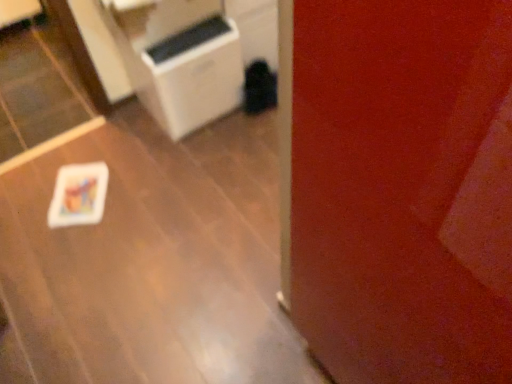
In order to face white glossy table at lower left, should I rotate leftwards or rightwards?

You should look left and rotate roughly 13.319 degrees.

What do you see at coordinates (153, 262) in the screenshot? Image resolution: width=512 pixels, height=384 pixels. I see `white glossy table at lower left` at bounding box center [153, 262].

Where is `white glossy table at lower left`? This screenshot has width=512, height=384. white glossy table at lower left is located at coordinates (153, 262).

In order to face white plastic air purifier at center, should I rotate leftwards or rightwards?

Turn left approximately 9.109 degrees to face it.

The image size is (512, 384). What do you see at coordinates (194, 76) in the screenshot? I see `white plastic air purifier at center` at bounding box center [194, 76].

Locate an element on the screen. white plastic air purifier at center is located at coordinates point(194,76).

At what (x,y) coordinates should I click in order to perform the action: click on white glossy table at lower left. Please return your answer as a coordinate pair (x, y). The image size is (512, 384). Looking at the image, I should click on (153, 262).

From the picture: Can you confirm if white plastic air purifier at center is positioned to the right of white glossy table at lower left?

Yes.

Is the depth of white plastic air purifier at center less than that of white glossy table at lower left?

No, it is not.

Does point (242, 74) come farther from viewer compared to point (232, 340)?

Yes.

From the image's perspective, between white plastic air purifier at center and white glossy table at lower left, which one is located above?

white plastic air purifier at center appears higher in the image.

From a real-world perspective, does white plastic air purifier at center sit lower than white glossy table at lower left?

No, from a real-world perspective, white plastic air purifier at center is not under white glossy table at lower left.

Considering the sizes of objects white plastic air purifier at center and white glossy table at lower left in the image provided, who is thinner, white plastic air purifier at center or white glossy table at lower left?

Thinner between the two is white plastic air purifier at center.

Considering the sizes of objects white plastic air purifier at center and white glossy table at lower left in the image provided, who is shorter, white plastic air purifier at center or white glossy table at lower left?

white glossy table at lower left.

Which of these two, white plastic air purifier at center or white glossy table at lower left, is smaller?

With smaller size is white glossy table at lower left.

Is white plastic air purifier at center not inside white glossy table at lower left?

Yes, white plastic air purifier at center is located beyond the bounds of white glossy table at lower left.

Is white plastic air purifier at center beside white glossy table at lower left?

No, white plastic air purifier at center is not next to white glossy table at lower left.

Does white plastic air purifier at center turn towards white glossy table at lower left?

No, white plastic air purifier at center is not aimed at white glossy table at lower left.

Can you tell me how much white plastic air purifier at center and white glossy table at lower left differ in facing direction?

There is a 0.426-degree angle between the facing directions of white plastic air purifier at center and white glossy table at lower left.

At what (x,y) coordinates should I click in order to perform the action: click on table on the left of the white plastic air purifier at center. Please return your answer as a coordinate pair (x, y). Looking at the image, I should click on (153, 262).

In the image, is white glossy table at lower left on the left side or the right side of white plastic air purifier at center?

white glossy table at lower left is to the left of white plastic air purifier at center.

Considering the positions of objects white glossy table at lower left and white plastic air purifier at center in the image provided, who is in front, white glossy table at lower left or white plastic air purifier at center?

white glossy table at lower left is closer to the camera.

Is point (157, 326) behind point (205, 87)?

No, (157, 326) is closer to viewer.

From the image's perspective, between white glossy table at lower left and white plastic air purifier at center, who is located below?

white glossy table at lower left, from the image's perspective.

From a real-world perspective, is white glossy table at lower left under white plastic air purifier at center?

Yes.

Which of these two, white glossy table at lower left or white plastic air purifier at center, is thinner?

With smaller width is white plastic air purifier at center.

Between white glossy table at lower left and white plastic air purifier at center, which one has more height?

white plastic air purifier at center is taller.

Can you confirm if white glossy table at lower left is smaller than white plastic air purifier at center?

Correct, white glossy table at lower left occupies less space than white plastic air purifier at center.

Based on the photo, do you think white glossy table at lower left is within white plastic air purifier at center, or outside of it?

white glossy table at lower left cannot be found inside white plastic air purifier at center.

Is white glossy table at lower left next to white plastic air purifier at center?

No, white glossy table at lower left is not in contact with white plastic air purifier at center.

Consider the image. Is white glossy table at lower left facing towards white plastic air purifier at center?

No, white glossy table at lower left is not turned towards white plastic air purifier at center.

How many degrees apart are the facing directions of white glossy table at lower left and white plastic air purifier at center?

0.426 degrees.

Where is `appliance on the right side of white glossy table at lower left`? Image resolution: width=512 pixels, height=384 pixels. appliance on the right side of white glossy table at lower left is located at coordinates (194, 76).

Find the location of a particular element. This screenshot has width=512, height=384. appliance above the white glossy table at lower left (from a real-world perspective) is located at coordinates (194, 76).

Find the location of a particular element. appliance behind the white glossy table at lower left is located at coordinates (194, 76).